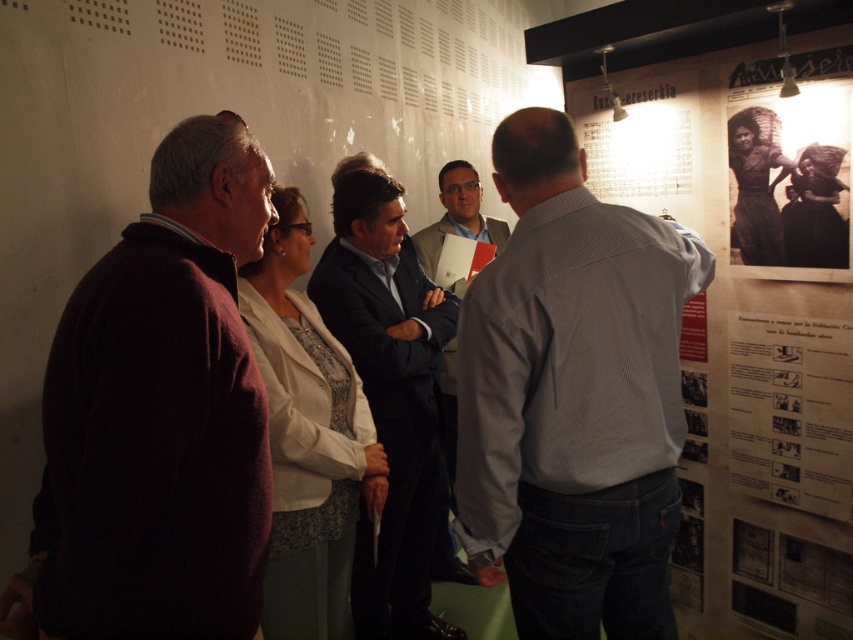
Question: Is dark blue suit at center above wooden signboard at center?

Choices:
 (A) yes
 (B) no

Answer: (B)

Question: Which object is farther from the camera taking this photo?

Choices:
 (A) dark blue suit at center
 (B) gray striped shirt at center
 (C) maroon sweater at left

Answer: (A)

Question: Can you confirm if gray striped shirt at center is smaller than maroon sweater at left?

Choices:
 (A) no
 (B) yes

Answer: (A)

Question: Is wooden signboard at center closer to camera compared to light brown leather jacket at center?

Choices:
 (A) yes
 (B) no

Answer: (A)

Question: Which point is closer to the camera?

Choices:
 (A) (125, 413)
 (B) (431, 570)
 (C) (454, 195)

Answer: (A)

Question: Which of the following is the closest to the observer?

Choices:
 (A) light brown leather jacket at center
 (B) wooden poster at right
 (C) gray striped shirt at center
 (D) maroon sweater at left

Answer: (D)